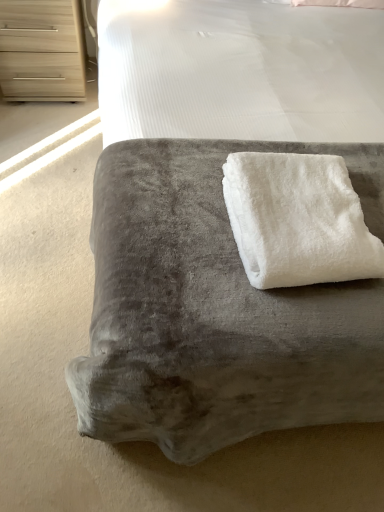
Question: Should I look upward or downward to see light wood chest of drawers at upper left?

Choices:
 (A) up
 (B) down

Answer: (A)

Question: Is velvet gray ottoman at center outside of light wood chest of drawers at upper left?

Choices:
 (A) no
 (B) yes

Answer: (B)

Question: Is velvet gray ottoman at center facing towards light wood chest of drawers at upper left?

Choices:
 (A) no
 (B) yes

Answer: (A)

Question: Is velvet gray ottoman at center with light wood chest of drawers at upper left?

Choices:
 (A) yes
 (B) no

Answer: (B)

Question: Does velvet gray ottoman at center lie behind light wood chest of drawers at upper left?

Choices:
 (A) yes
 (B) no

Answer: (B)

Question: From a real-world perspective, is velvet gray ottoman at center positioned under light wood chest of drawers at upper left based on gravity?

Choices:
 (A) no
 (B) yes

Answer: (A)

Question: Can you confirm if velvet gray ottoman at center is smaller than light wood chest of drawers at upper left?

Choices:
 (A) yes
 (B) no

Answer: (B)

Question: Are velvet gray ottoman at center and white fluffy towel at center beside each other?

Choices:
 (A) yes
 (B) no

Answer: (B)

Question: Is velvet gray ottoman at center positioned beyond the bounds of white fluffy towel at center?

Choices:
 (A) yes
 (B) no

Answer: (A)

Question: Does velvet gray ottoman at center have a lesser width compared to white fluffy towel at center?

Choices:
 (A) yes
 (B) no

Answer: (B)

Question: Does velvet gray ottoman at center come behind white fluffy towel at center?

Choices:
 (A) yes
 (B) no

Answer: (B)

Question: Is velvet gray ottoman at center closer to the viewer compared to white fluffy towel at center?

Choices:
 (A) yes
 (B) no

Answer: (A)

Question: Is velvet gray ottoman at center smaller than white fluffy towel at center?

Choices:
 (A) no
 (B) yes

Answer: (A)

Question: Is white fluffy towel at center turned away from velvet gray ottoman at center?

Choices:
 (A) no
 (B) yes

Answer: (A)